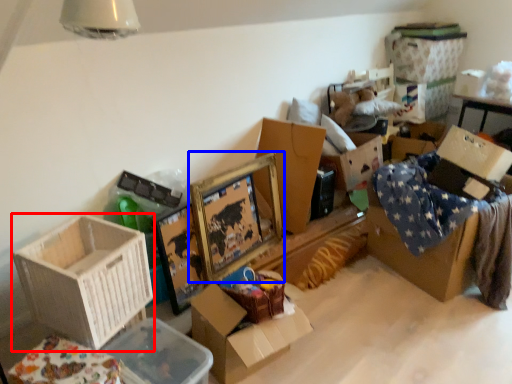
Question: Which point is further to the camera, box (highlighted by a red box) or picture frame (highlighted by a blue box)?

Choices:
 (A) box
 (B) picture frame

Answer: (B)